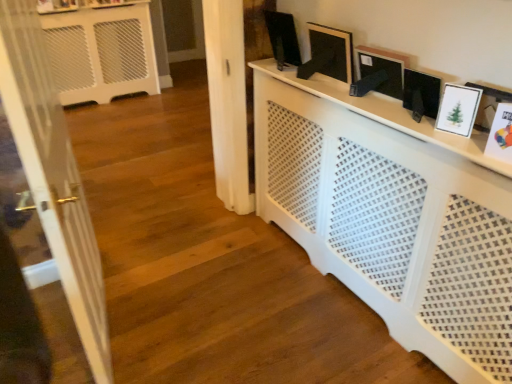
At what (x,y) coordinates should I click in order to perform the action: click on vacant space situated on the left part of white matte picture frame at upper right, which is the 3th picture frame in left-to-right order. Please return your answer as a coordinate pair (x, y). Looking at the image, I should click on (378, 112).